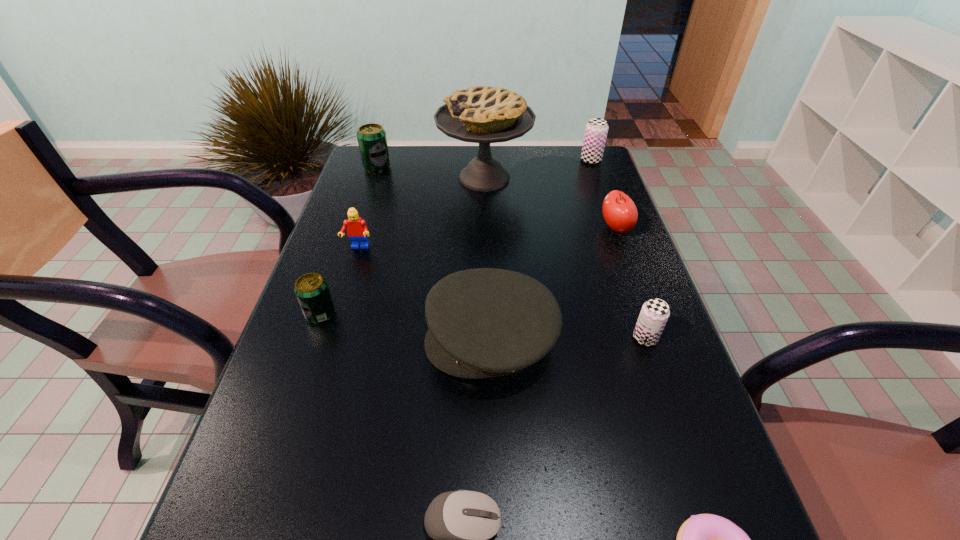
The image size is (960, 540). I want to click on the smaller green beer can, so click(311, 289).

The height and width of the screenshot is (540, 960). I want to click on free spot located 0.130m on the cut side of the tallest object, so tap(396, 178).

Locate an element on the screen. vacant area located on the cut side of the tallest object is located at coordinates (368, 178).

This screenshot has height=540, width=960. Find the location of `free region located 0.140m on the cut side of the tallest object`. free region located 0.140m on the cut side of the tallest object is located at coordinates (394, 178).

You are a GUI agent. You are given a task and a screenshot of the screen. Output one action in this format:
    pyautogui.click(x=<x>, y=<y>)
    Task: Click on the vacant region located on the front of the bigger purple beer can
    
    Given the screenshot: What is the action you would take?
    pyautogui.click(x=599, y=182)

The height and width of the screenshot is (540, 960). What are the coordinates of `vacant space located on the front of the bigger green beer can` in the screenshot? It's located at (351, 248).

Image resolution: width=960 pixels, height=540 pixels. Find the location of `vacant region located 0.120m on the front-facing side of the beret`. vacant region located 0.120m on the front-facing side of the beret is located at coordinates (367, 341).

The height and width of the screenshot is (540, 960). Find the location of `blank space located 0.100m on the front-facing side of the beret`. blank space located 0.100m on the front-facing side of the beret is located at coordinates (376, 341).

This screenshot has width=960, height=540. I want to click on free space located 0.050m on the front-facing side of the beret, so click(x=400, y=341).

This screenshot has height=540, width=960. In order to click on free space located on the left of the seventh nearest object in this screenshot , I will do `click(490, 228)`.